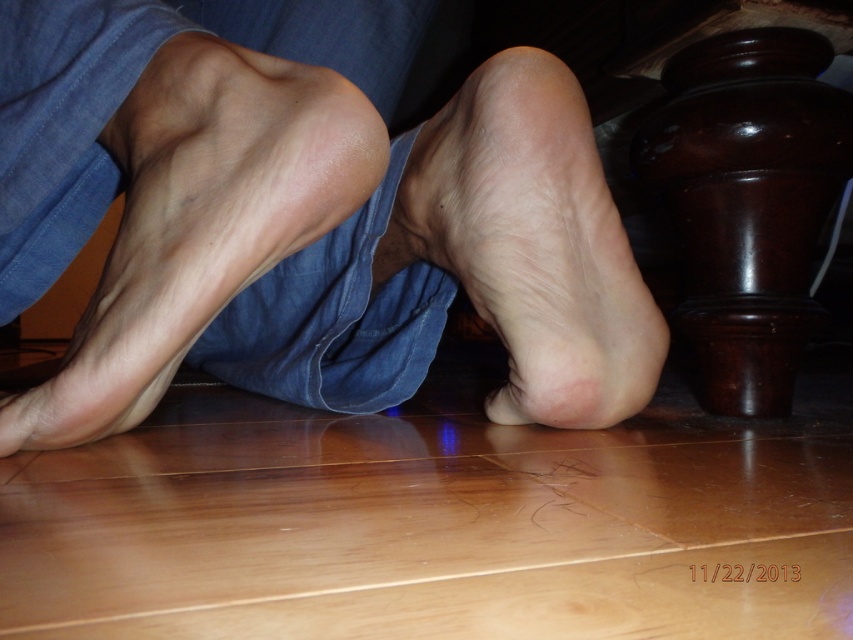
Who is positioned more to the right, smooth skin feet at center or smooth skin foot at center?

smooth skin foot at center

Is point (593, 404) positioned behind point (494, 292)?

No.

Where is `smooth skin feet at center`? The image size is (853, 640). smooth skin feet at center is located at coordinates (305, 212).